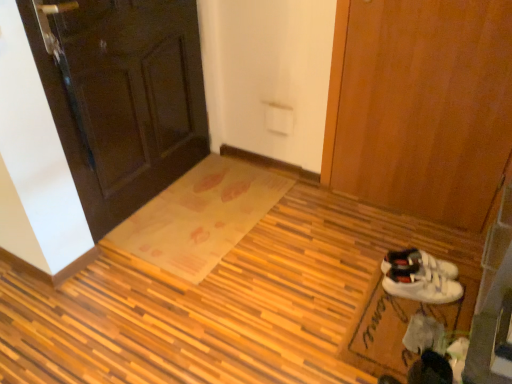
Identify the location of free point behind white fabric doormat at lower right, arranged as the 2th doormat when viewed from the left. (366, 239).